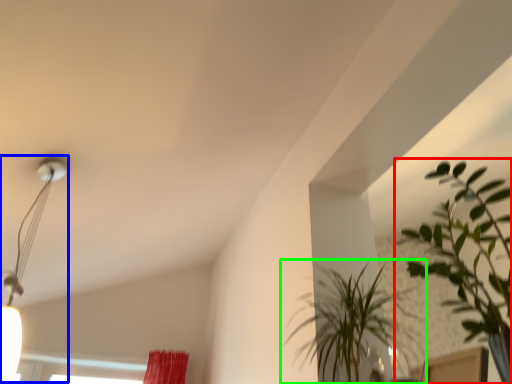
Question: Which is farther away from houseplant (highlighted by a red box)? lamp (highlighted by a blue box) or houseplant (highlighted by a green box)?

Choices:
 (A) lamp
 (B) houseplant

Answer: (A)